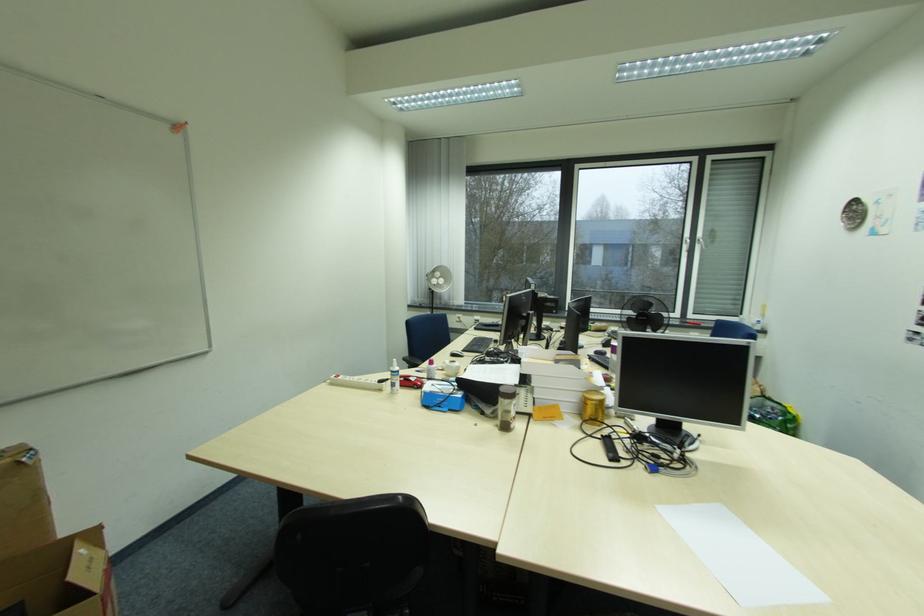
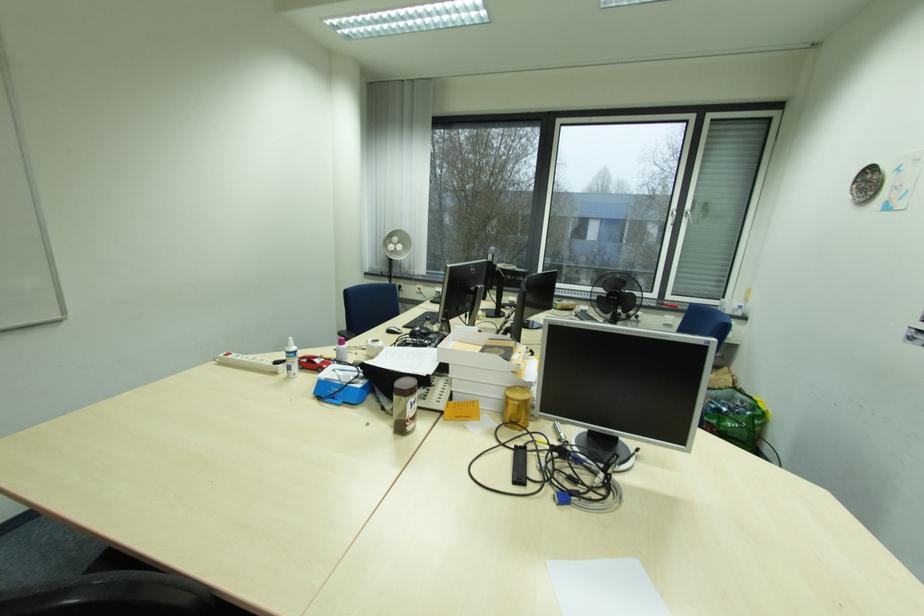
Question: How did the camera likely rotate?

Choices:
 (A) Left
 (B) Right
 (C) Up
 (D) Down

Answer: (D)